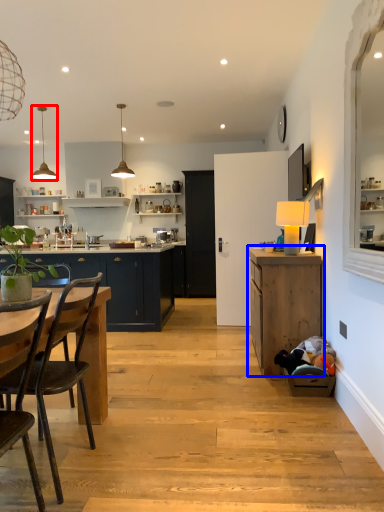
Question: Which object is closer to the camera taking this photo, lamp (highlighted by a red box) or cabinetry (highlighted by a blue box)?

Choices:
 (A) lamp
 (B) cabinetry

Answer: (B)